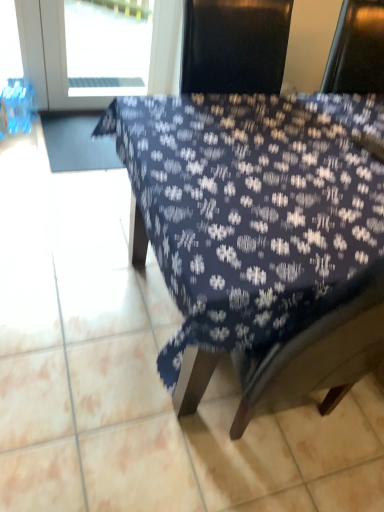
Describe the element at coordinates (263, 237) in the screenshot. I see `dark blue fabric at center` at that location.

What are the coordinates of `dark blue fabric at center` in the screenshot? It's located at (263, 237).

Where is `dark blue fabric at center`? dark blue fabric at center is located at coordinates (263, 237).